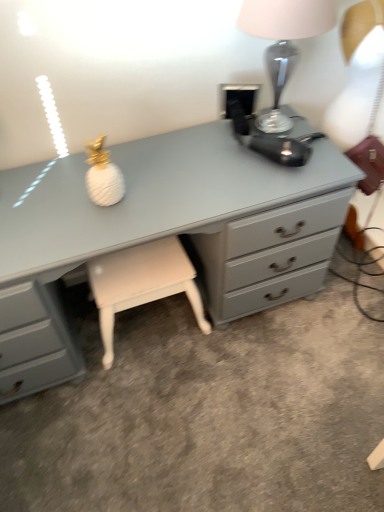
Question: Is matte gray chest of drawers at center to the left of white leather stool at center from the viewer's perspective?

Choices:
 (A) no
 (B) yes

Answer: (A)

Question: Considering the relative sizes of matte gray chest of drawers at center and white leather stool at center in the image provided, is matte gray chest of drawers at center taller than white leather stool at center?

Choices:
 (A) yes
 (B) no

Answer: (A)

Question: Does matte gray chest of drawers at center turn towards white leather stool at center?

Choices:
 (A) no
 (B) yes

Answer: (B)

Question: Does matte gray chest of drawers at center have a lesser height compared to white leather stool at center?

Choices:
 (A) yes
 (B) no

Answer: (B)

Question: From the image's perspective, is matte gray chest of drawers at center on white leather stool at center?

Choices:
 (A) no
 (B) yes

Answer: (B)

Question: Is matte gray chest of drawers at center to the left or to the right of satin silver lamp at upper right in the image?

Choices:
 (A) right
 (B) left

Answer: (B)

Question: From the image's perspective, relative to satin silver lamp at upper right, is matte gray chest of drawers at center above or below?

Choices:
 (A) below
 (B) above

Answer: (A)

Question: Does point (147, 141) appear closer or farther from the camera than point (321, 10)?

Choices:
 (A) closer
 (B) farther

Answer: (B)

Question: In terms of width, does matte gray chest of drawers at center look wider or thinner when compared to satin silver lamp at upper right?

Choices:
 (A) wide
 (B) thin

Answer: (A)

Question: Based on their positions, is satin silver lamp at upper right located to the left or right of matte gray chest of drawers at center?

Choices:
 (A) left
 (B) right

Answer: (B)

Question: Looking at the image, does satin silver lamp at upper right seem bigger or smaller compared to matte gray chest of drawers at center?

Choices:
 (A) big
 (B) small

Answer: (B)

Question: Is satin silver lamp at upper right inside the boundaries of matte gray chest of drawers at center, or outside?

Choices:
 (A) inside
 (B) outside

Answer: (B)

Question: Considering the positions of point (266, 20) and point (211, 197), is point (266, 20) closer or farther from the camera than point (211, 197)?

Choices:
 (A) closer
 (B) farther

Answer: (A)

Question: From a real-world perspective, is white leather stool at center above or below satin silver lamp at upper right?

Choices:
 (A) above
 (B) below

Answer: (B)

Question: Is white leather stool at center spatially inside satin silver lamp at upper right, or outside of it?

Choices:
 (A) outside
 (B) inside

Answer: (A)